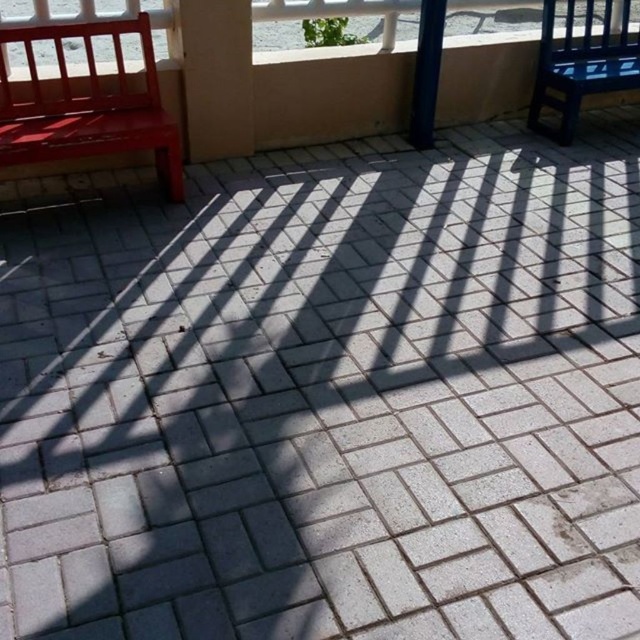
Question: Among these objects, which one is nearest to the camera?

Choices:
 (A) blue glossy chair at right
 (B) matte red bench at left

Answer: (B)

Question: Is matte red bench at left in front of blue glossy chair at right?

Choices:
 (A) yes
 (B) no

Answer: (A)

Question: Observing the image, what is the correct spatial positioning of matte red bench at left in reference to blue glossy chair at right?

Choices:
 (A) right
 (B) left

Answer: (B)

Question: Which object is closer to the camera taking this photo?

Choices:
 (A) matte red bench at left
 (B) blue glossy chair at right

Answer: (A)

Question: Is matte red bench at left smaller than blue glossy chair at right?

Choices:
 (A) no
 (B) yes

Answer: (A)